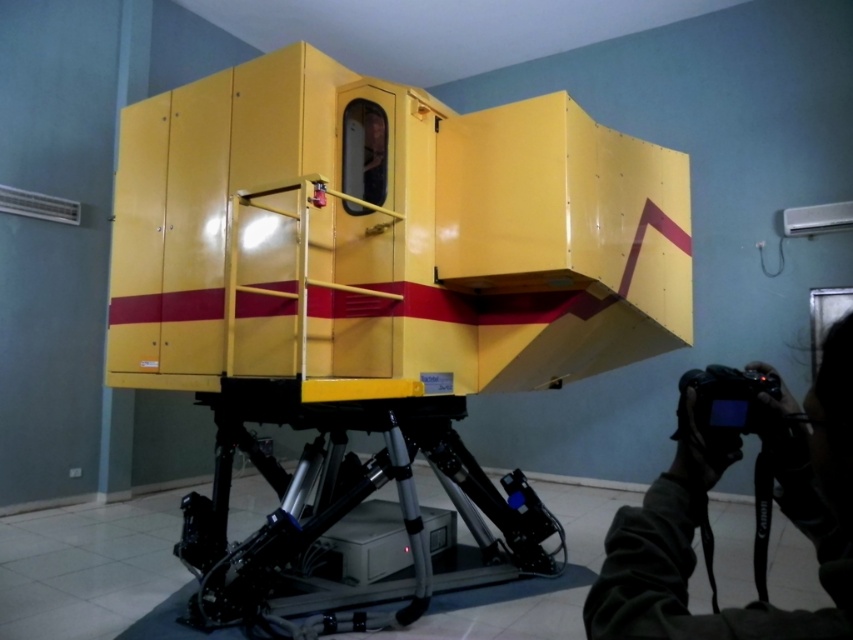
Question: Which of these objects is positioned farthest from the black fabric camera at lower right?

Choices:
 (A) metallic tripod at lower center
 (B) black plastic video camera at lower right

Answer: (A)

Question: Which point is farther to the camera?

Choices:
 (A) black plastic video camera at lower right
 (B) metallic tripod at lower center

Answer: (B)

Question: Which object is closer to the camera taking this photo?

Choices:
 (A) black fabric camera at lower right
 (B) metallic tripod at lower center

Answer: (A)

Question: Does metallic tripod at lower center appear over black plastic video camera at lower right?

Choices:
 (A) no
 (B) yes

Answer: (A)

Question: Can you confirm if metallic tripod at lower center is bigger than black fabric camera at lower right?

Choices:
 (A) yes
 (B) no

Answer: (A)

Question: Is black fabric camera at lower right smaller than black plastic video camera at lower right?

Choices:
 (A) no
 (B) yes

Answer: (A)